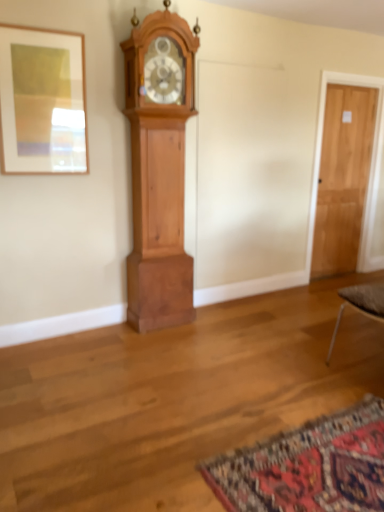
This screenshot has width=384, height=512. Identify the location of vacant region above light brown wooden door at right (from a real-world perspective). (359, 83).